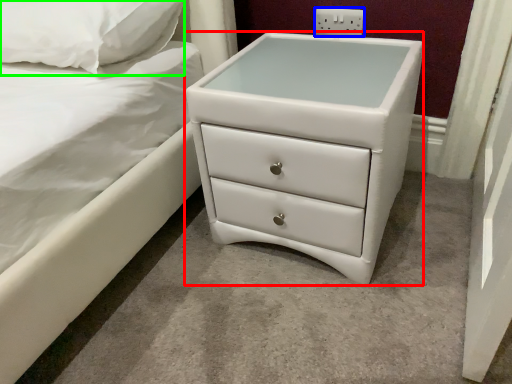
Question: Which is nearer to the chest of drawers (highlighted by a red box)? electric outlet (highlighted by a blue box) or pillow (highlighted by a green box).

Choices:
 (A) electric outlet
 (B) pillow

Answer: (A)